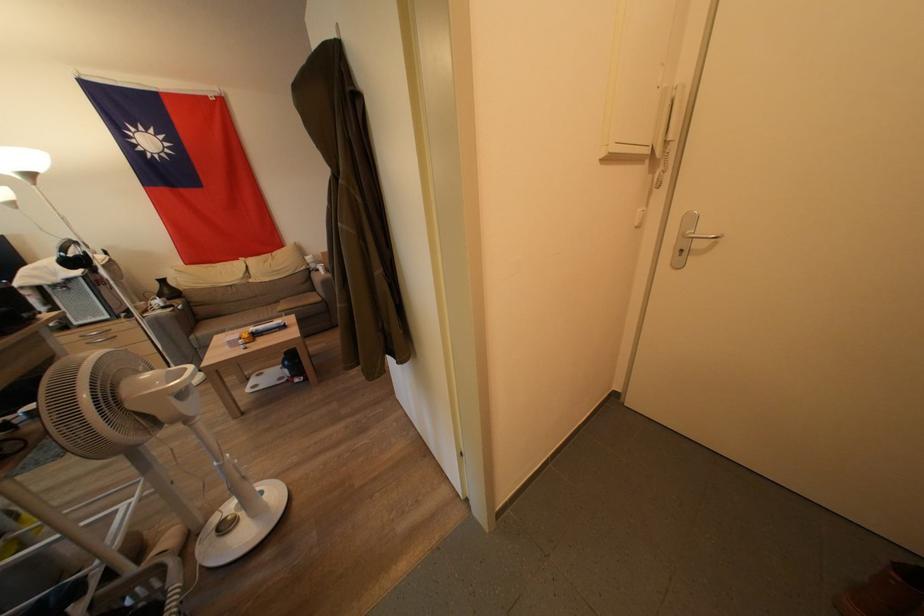
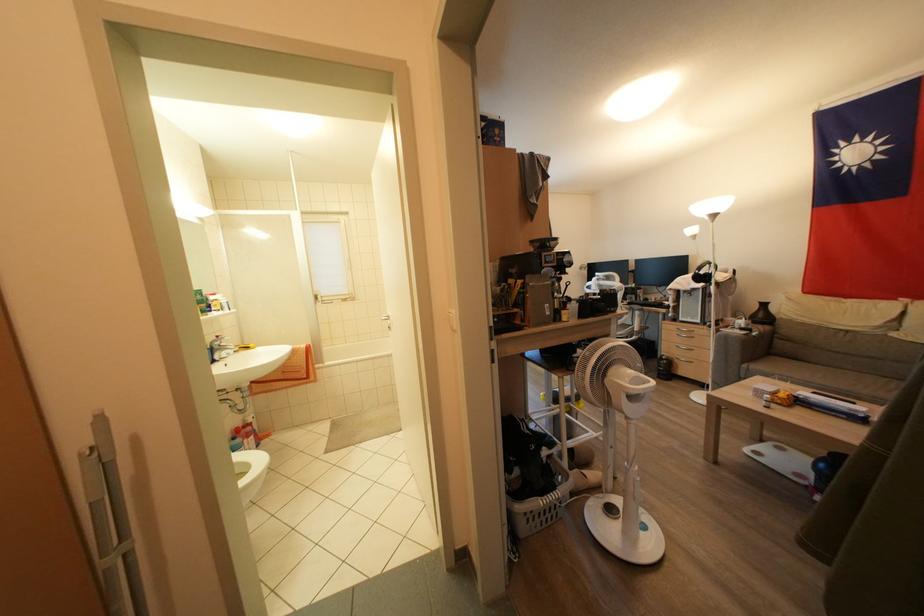
The point at [192,424] is marked in the first image. Where is the corresponding point in the second image?

(631, 421)